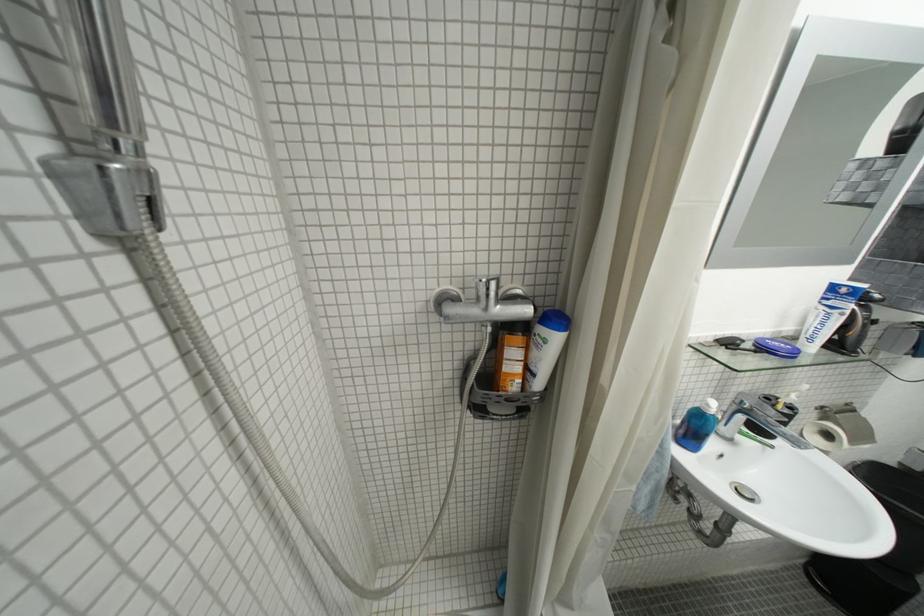
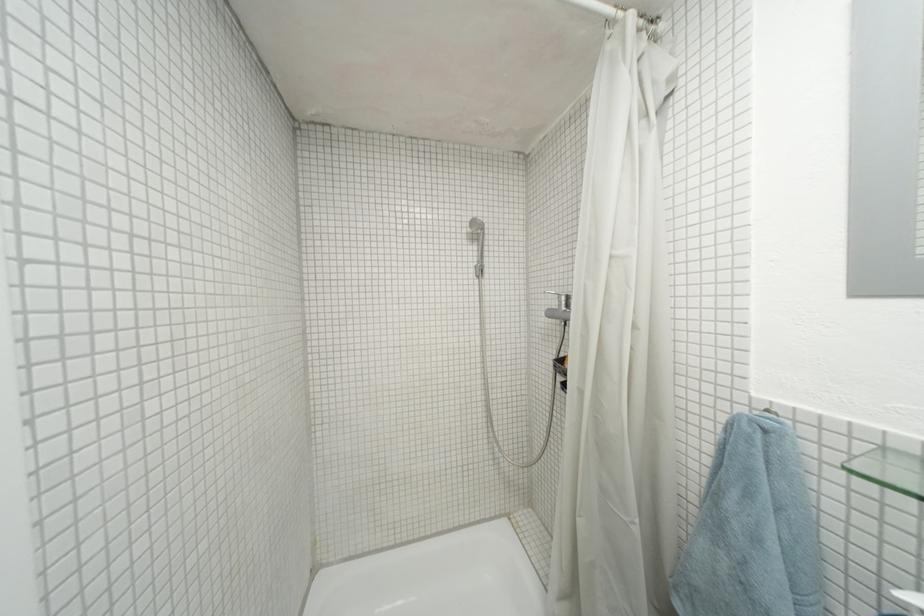
Question: Based on the continuous images, in which direction is the camera rotating? Reply with the corresponding letter.

Choices:
 (A) Left
 (B) Right
 (C) Up
 (D) Down

Answer: (A)